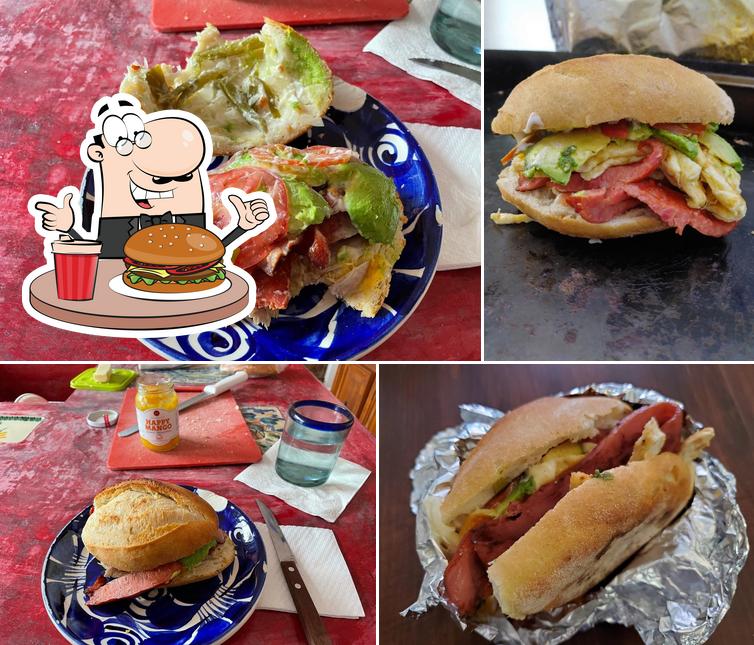
At what (x,y) coordinates should I click in order to perform the action: click on glass. Please return your answer as a coordinate pair (x, y). Looking at the image, I should click on (314, 459), (75, 275), (448, 33).